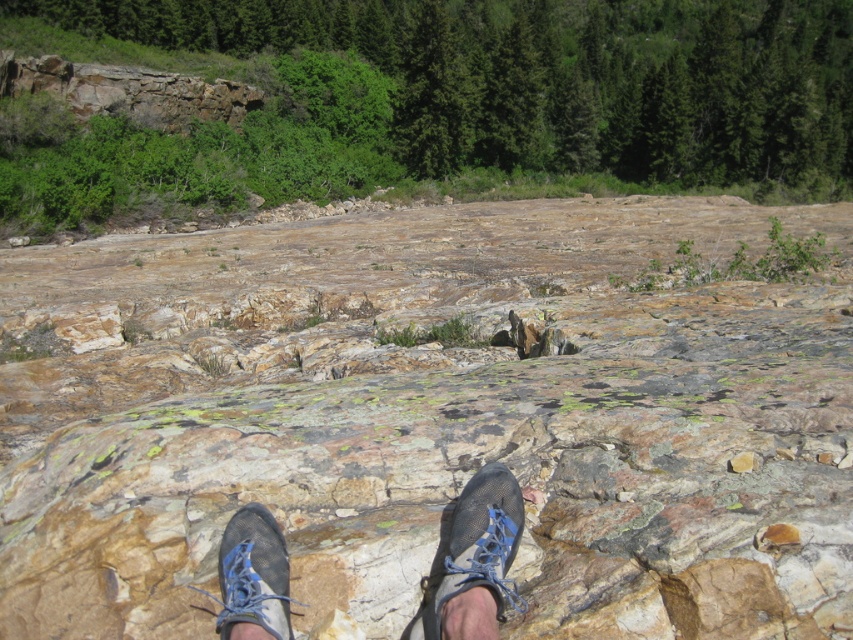
You are a photographer aiming to capture a closeup of the matte gray shoe at center. Given that your camera lens has a minimum focusing distance of 5 feet, will you be able to take the photo without moving closer?

The distance between the matte gray shoe at center and the camera is 5.49 feet, which is slightly more than the minimum focusing distance of 5 feet. Therefore, you can take the photo without moving closer.

You are a hiker trying to navigate the rocky terrain. You notice two shoes in the image, the matte gray shoe at center and the matte black shoe at center. Which shoe is positioned higher relative to the other?

The matte gray shoe at center is positioned higher than the matte black shoe at center because it is above it.

You are a hiker who needs to choose between the textured gray shoes at center and the matte black shoe at center for a rocky trail. Which pair has a larger size?

The textured gray shoes at center is bigger than matte black shoe at center, so the textured gray shoes at center would be the larger pair.